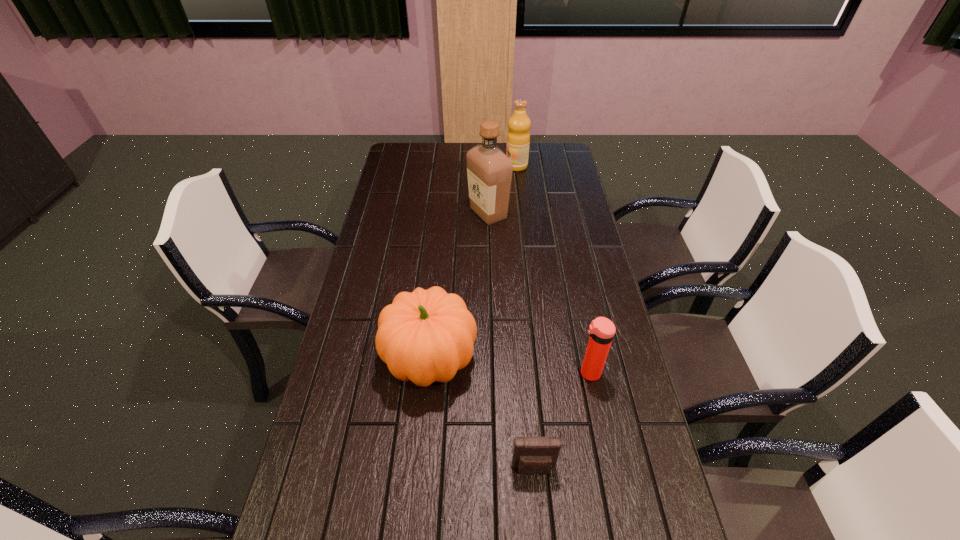
Identify the location of free space located 0.370m on the front-facing side of the tallest object. The width and height of the screenshot is (960, 540). (372, 213).

Identify the location of vacant space located 0.310m on the front label of the farthest object. The width and height of the screenshot is (960, 540). (437, 166).

Where is `vacant position located 0.190m on the front label of the farthest object`? vacant position located 0.190m on the front label of the farthest object is located at coordinates (464, 166).

Locate an element on the screen. The width and height of the screenshot is (960, 540). free region located 0.310m on the front label of the farthest object is located at coordinates (437, 166).

Locate an element on the screen. The height and width of the screenshot is (540, 960). free spot located 0.340m on the right of the pumpkin is located at coordinates (597, 360).

The width and height of the screenshot is (960, 540). Identify the location of vacant space located on the front of the thermos bottle. (612, 484).

Find the location of a particular element. This screenshot has width=960, height=540. vacant space situated with an open flap on the shortest object is located at coordinates (539, 525).

Where is `object that is at the far edge`? This screenshot has width=960, height=540. object that is at the far edge is located at coordinates (518, 137).

Where is `object that is positioned at the left edge`? object that is positioned at the left edge is located at coordinates (425, 336).

Image resolution: width=960 pixels, height=540 pixels. Identify the location of object present at the right edge. (601, 330).